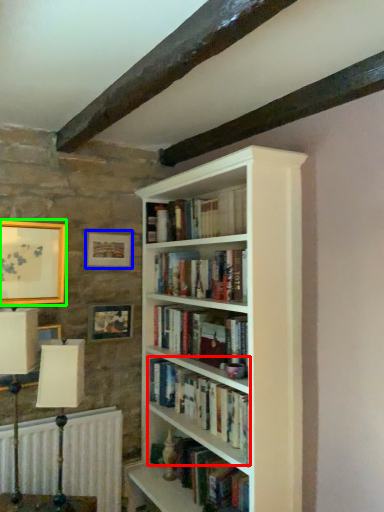
Question: Which is nearer to the book (highlighted by a red box)? picture frame (highlighted by a blue box) or picture frame (highlighted by a green box).

Choices:
 (A) picture frame
 (B) picture frame

Answer: (A)